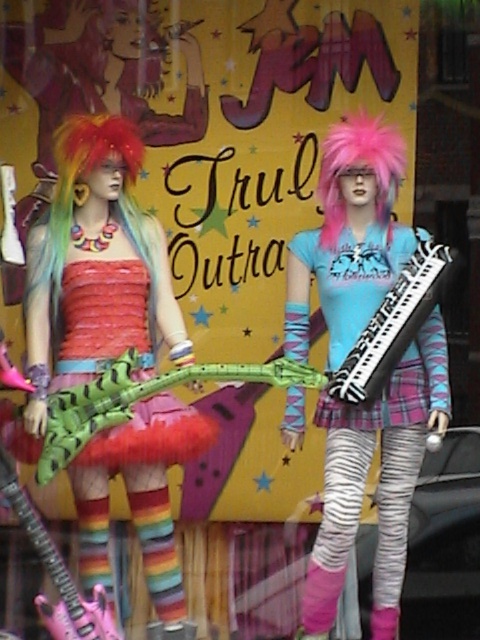
You are standing in front of the storefront window displaying two mannequins. You notice two points marked in the scene. The first point is at coordinates point (x=219, y=378) and the second is at point (x=350, y=154). Which point is closer to you as you face the window?

Point (x=219, y=378) is in front of point (x=350, y=154), so it is closer to you as you face the window.

You are a customer standing in front of the store window. You see the green matte guitar at center and the pink fluffy wig at center. Which object is closer to your left side?

The green matte guitar at center is closer to your left side because it is positioned to the left of the pink fluffy wig at center.

You are a customer standing in front of the store window. You see the matte pink guitar at left. Can you estimate its exact location in the window display?

The matte pink guitar at left is located at point (x=93, y=273) in the window display.